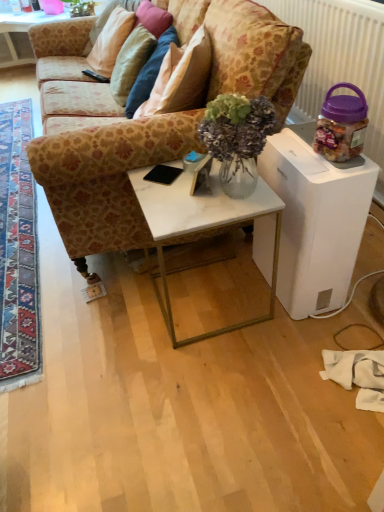
Locate an element on the screen. free area below translucent glass vase at center (from a real-world perspective) is located at coordinates (235, 199).